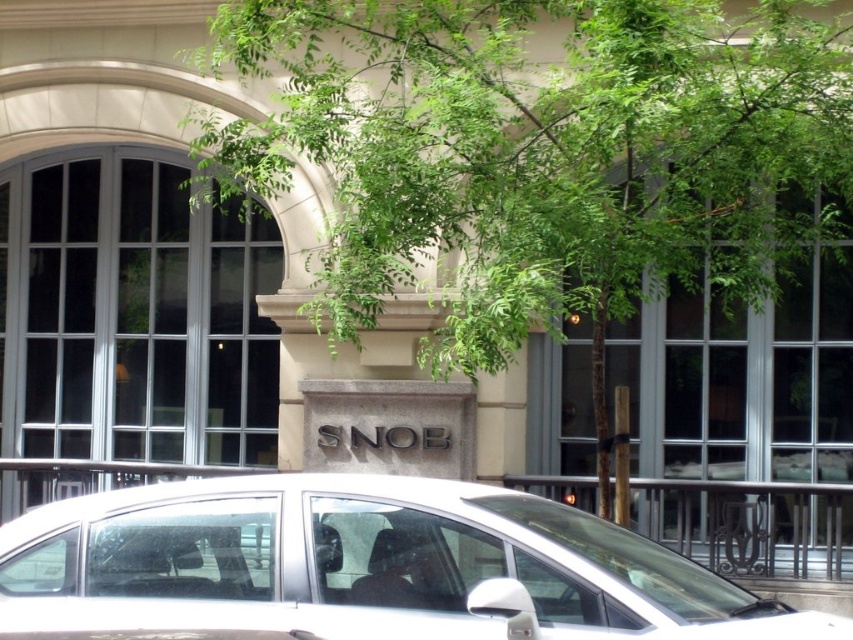
Question: Where is green leafy tree at center located in relation to white matte car at center in the image?

Choices:
 (A) below
 (B) above

Answer: (B)

Question: Where is green leafy tree at center located in relation to white matte car at center in the image?

Choices:
 (A) above
 (B) below

Answer: (A)

Question: Among these points, which one is nearest to the camera?

Choices:
 (A) (317, 552)
 (B) (596, 125)

Answer: (A)

Question: Which point is farther to the camera?

Choices:
 (A) (297, 515)
 (B) (361, 12)

Answer: (B)

Question: Which object appears closest to the camera in this image?

Choices:
 (A) green leafy tree at center
 (B) white matte car at center

Answer: (B)

Question: Is green leafy tree at center further to camera compared to white matte car at center?

Choices:
 (A) yes
 (B) no

Answer: (A)